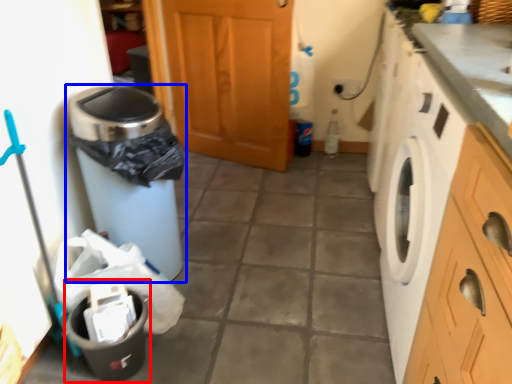
Question: Which object is closer to the camera taking this photo, recycling bin (highlighted by a red box) or waste container (highlighted by a blue box)?

Choices:
 (A) recycling bin
 (B) waste container

Answer: (A)